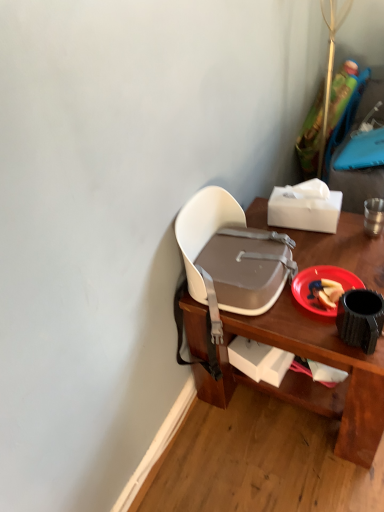
Identify the location of free area in between red plastic plate at lower right and white matte tissue box at upper right, which is the 1th box from top to bottom. The width and height of the screenshot is (384, 512). (324, 250).